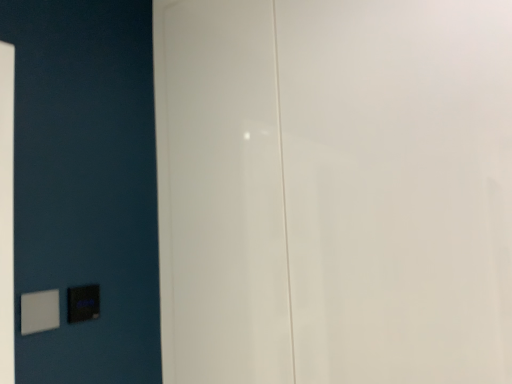
Question: Is white glossy door at center inside or outside of white plastic light switch at lower left, which is the 2th light switch in right-to-left order?

Choices:
 (A) inside
 (B) outside

Answer: (B)

Question: Considering the positions of point (373, 44) and point (26, 314), is point (373, 44) closer or farther from the camera than point (26, 314)?

Choices:
 (A) closer
 (B) farther

Answer: (A)

Question: Estimate the real-world distances between objects in this image. Which object is farther from the white plastic light switch at lower left, the second light switch when ordered from back to front?

Choices:
 (A) matte black switch at lower left, the first light switch in the back-to-front sequence
 (B) white glossy door at center

Answer: (B)

Question: Which of these objects is positioned farthest from the matte black switch at lower left, the second light switch in the left-to-right sequence?

Choices:
 (A) white glossy door at center
 (B) white plastic light switch at lower left, which ranks as the first light switch in front-to-back order

Answer: (A)